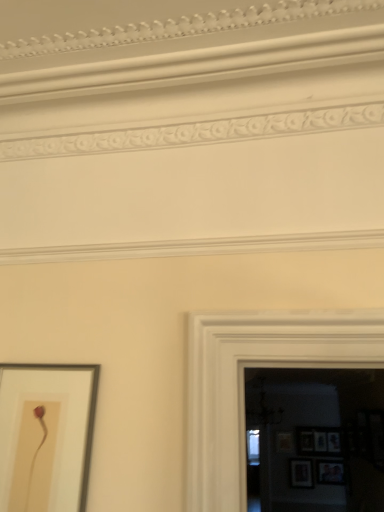
Question: Can you confirm if wooden picture frame at right, the 1th picture frame in the back-to-front sequence, is shorter than matte wooden picture frame at lower right, the 2th picture frame positioned from the bottom?

Choices:
 (A) yes
 (B) no

Answer: (A)

Question: Does wooden picture frame at right, the fourth picture frame positioned from the right, have a smaller size compared to matte wooden picture frame at lower right, placed as the fifth picture frame when sorted from left to right?

Choices:
 (A) no
 (B) yes

Answer: (B)

Question: Considering the relative sizes of wooden picture frame at right, the 3th picture frame in the bottom-to-top sequence, and matte wooden picture frame at lower right, the 2th picture frame positioned from the bottom, in the image provided, is wooden picture frame at right, the 3th picture frame in the bottom-to-top sequence, thinner than matte wooden picture frame at lower right, the 2th picture frame positioned from the bottom,?

Choices:
 (A) yes
 (B) no

Answer: (A)

Question: Is wooden picture frame at right, the 1th picture frame in the back-to-front sequence, aimed at matte wooden picture frame at lower right, positioned as the fourth picture frame in top-to-bottom order?

Choices:
 (A) no
 (B) yes

Answer: (A)

Question: Is wooden picture frame at right, positioned as the 5th picture frame in front-to-back order, far from matte wooden picture frame at lower right, which is the 4th picture frame from back to front?

Choices:
 (A) no
 (B) yes

Answer: (A)

Question: From a real-world perspective, is wooden picture frame at right, the 1th picture frame in the back-to-front sequence, on matte wooden picture frame at lower right, which is the 4th picture frame from back to front?

Choices:
 (A) no
 (B) yes

Answer: (B)

Question: Is wooden picture frame at right, arranged as the 3th picture frame when viewed from the top, at the left side of wooden picture frame at lower right, which is the 4th picture frame in left-to-right order?

Choices:
 (A) no
 (B) yes

Answer: (B)

Question: From a real-world perspective, is wooden picture frame at right, the 3th picture frame in the bottom-to-top sequence, under wooden picture frame at lower right, the second picture frame viewed from the top?

Choices:
 (A) no
 (B) yes

Answer: (B)

Question: Does wooden picture frame at right, positioned as the second picture frame in left-to-right order, have a lesser width compared to wooden picture frame at lower right, the fourth picture frame from the front?

Choices:
 (A) no
 (B) yes

Answer: (A)

Question: Does wooden picture frame at right, arranged as the 3th picture frame when viewed from the top, lie in front of wooden picture frame at lower right, the second picture frame viewed from the top?

Choices:
 (A) yes
 (B) no

Answer: (B)

Question: Can you confirm if wooden picture frame at right, arranged as the 3th picture frame when viewed from the top, is wider than wooden picture frame at lower right, the second picture frame viewed from the back?

Choices:
 (A) yes
 (B) no

Answer: (A)

Question: Does wooden picture frame at right, the 3th picture frame in the bottom-to-top sequence, have a smaller size compared to wooden picture frame at lower right, the second picture frame viewed from the top?

Choices:
 (A) no
 (B) yes

Answer: (B)

Question: Considering the relative sizes of wooden picture frame at lower right, the third picture frame from the left, and wooden picture frame at lower right, which ranks as the fourth picture frame in bottom-to-top order, in the image provided, is wooden picture frame at lower right, the third picture frame from the left, smaller than wooden picture frame at lower right, which ranks as the fourth picture frame in bottom-to-top order,?

Choices:
 (A) no
 (B) yes

Answer: (B)